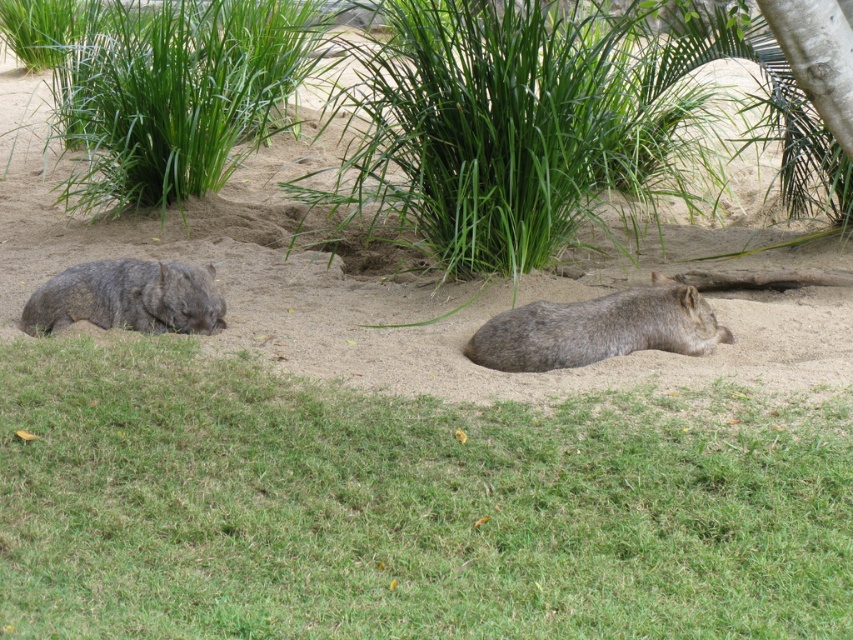
You are a zookeeper observing the wombats in their enclosure. You notice the brown furry wombat at center and the gray furry wombat at left. Which wombat is located to the right of the other?

The brown furry wombat at center is positioned on the right side of the gray furry wombat at left.

You are a zookeeper observing the wombats in their enclosure. You notice the brown furry wombat at center and the gray furry wombat at left. Which wombat is located directly above the other?

The brown furry wombat at center is positioned under the gray furry wombat at left, meaning the gray furry wombat at left is directly above the brown furry wombat at center.